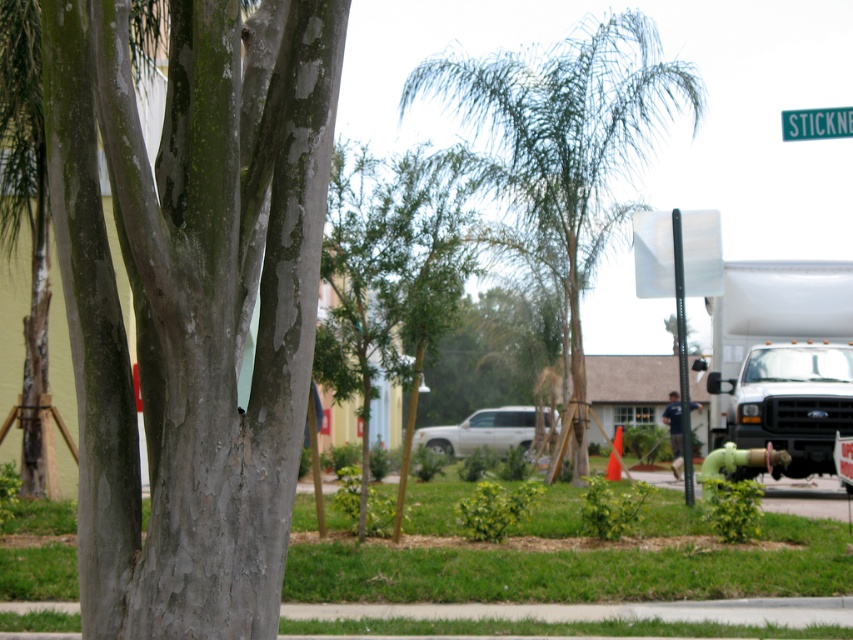
Question: Can you confirm if white matte truck at right is bigger than green plastic sign at upper right?

Choices:
 (A) yes
 (B) no

Answer: (A)

Question: Does black metal pole at upper right have a lesser width compared to green plastic sign at upper right?

Choices:
 (A) no
 (B) yes

Answer: (A)

Question: Does gray textured bark at center come behind white matte suv at center?

Choices:
 (A) yes
 (B) no

Answer: (B)

Question: Which point is closer to the camera?

Choices:
 (A) green plastic sign at upper right
 (B) white matte truck at right
 (C) white matte suv at center

Answer: (A)

Question: Which of the following is the farthest from the observer?

Choices:
 (A) green plastic sign at upper right
 (B) green leafy palm tree at center

Answer: (B)

Question: Which is farther from the black metal pole at upper right?

Choices:
 (A) green leafy palm tree at center
 (B) white matte suv at center
 (C) orange matte traffic cone at center

Answer: (A)